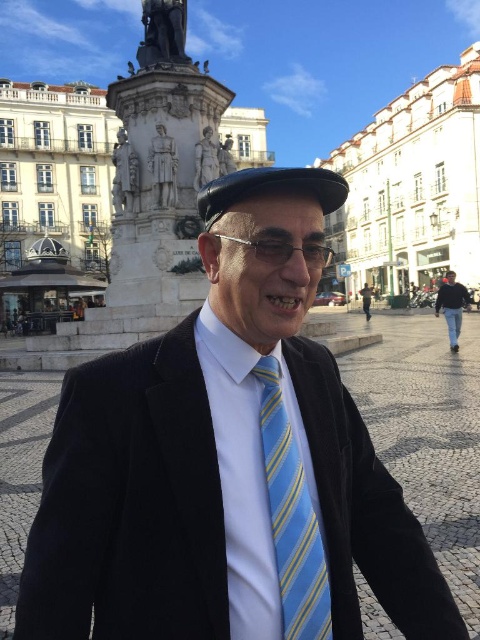
Question: Among these objects, which one is farthest from the camera?

Choices:
 (A) leather cap at center
 (B) black velvet suit at center
 (C) blue striped tie at center

Answer: (A)

Question: Among these points, which one is farthest from the camera?

Choices:
 (A) (458, 333)
 (B) (223, 176)

Answer: (A)

Question: Estimate the real-world distances between objects in this image. Which object is closer to the leather cap at center?

Choices:
 (A) blue striped tie at center
 (B) black cotton jacket at right
 (C) black velvet suit at center

Answer: (C)

Question: In this image, where is blue striped tie at center located relative to leather cap at center?

Choices:
 (A) above
 (B) below

Answer: (B)

Question: Can you confirm if blue striped tie at center is smaller than leather cap at center?

Choices:
 (A) yes
 (B) no

Answer: (A)

Question: Observing the image, what is the correct spatial positioning of leather cap at center in reference to black cotton jacket at right?

Choices:
 (A) below
 (B) above

Answer: (B)